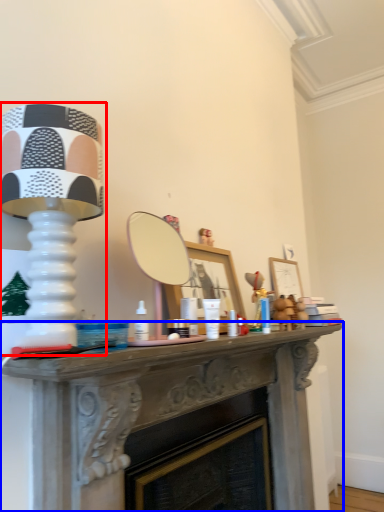
Question: Which object is further to the camera taking this photo, table lamp (highlighted by a red box) or table (highlighted by a blue box)?

Choices:
 (A) table lamp
 (B) table

Answer: (B)